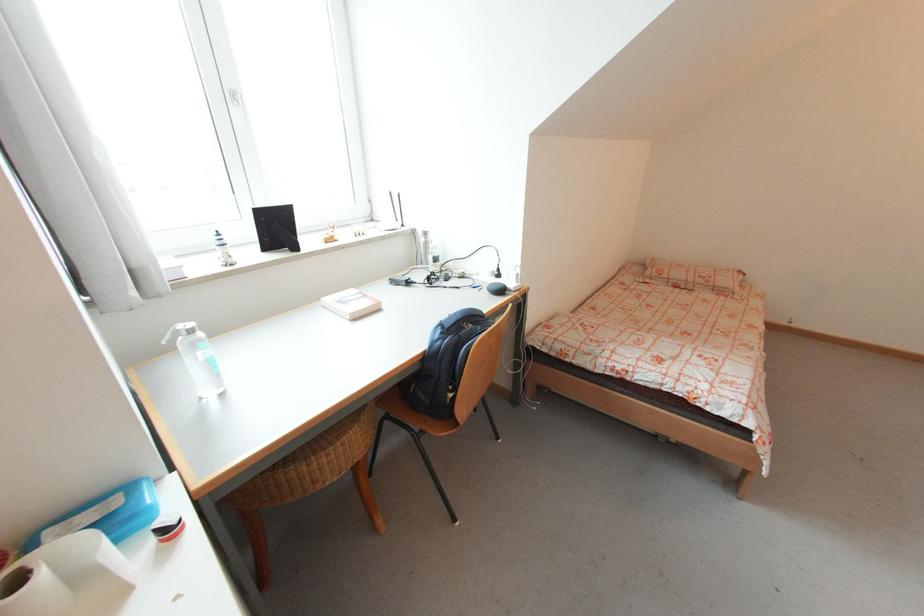
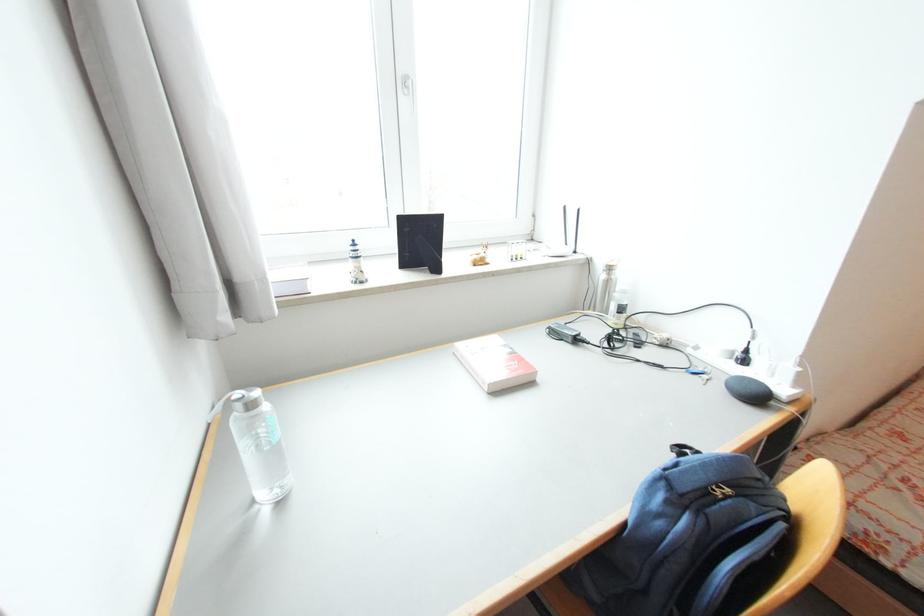
The point at (435, 246) is marked in the first image. Where is the corresponding point in the second image?

(623, 288)